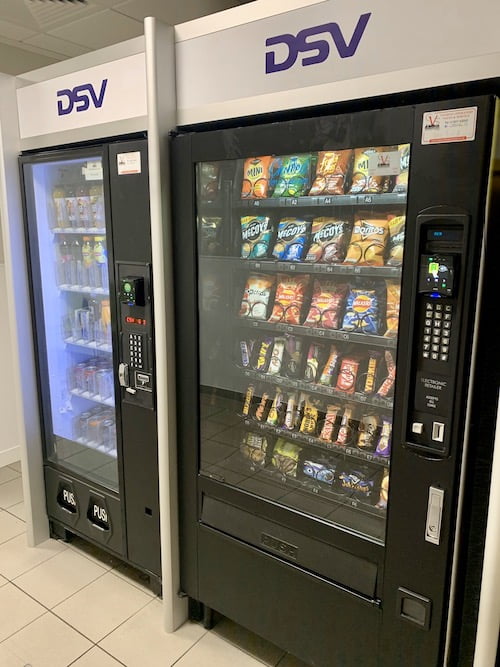
Identify the location of tiled floor - empty space. [62, 637].